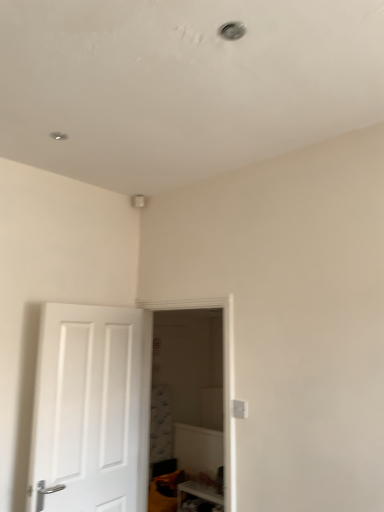
Where is `transparent glass door at center`? The width and height of the screenshot is (384, 512). transparent glass door at center is located at coordinates (223, 378).

Where is `white matte door at left`? The height and width of the screenshot is (512, 384). white matte door at left is located at coordinates (91, 410).

Which is more to the left, transparent glass door at center or white matte door at left?

white matte door at left is more to the left.

In terms of width, does transparent glass door at center look wider or thinner when compared to white matte door at left?

In the image, transparent glass door at center appears to be wider than white matte door at left.

Considering the sizes of objects white glossy shelf at lower right and white matte door at left in the image provided, who is shorter, white glossy shelf at lower right or white matte door at left?

white glossy shelf at lower right.

Which object is closer to the camera taking this photo, white glossy shelf at lower right or white matte door at left?

white matte door at left is more forward.

Are white glossy shelf at lower right and white matte door at left far apart?

white glossy shelf at lower right is far away from white matte door at left.

Is white matte door at left situated inside white glossy shelf at lower right or outside?

The correct answer is: outside.

Is white matte door at left bigger or smaller than white glossy shelf at lower right?

white matte door at left is bigger than white glossy shelf at lower right.

Consider the image. From the image's perspective, is white matte door at left below white glossy shelf at lower right?

Incorrect, from the image's perspective, white matte door at left is higher than white glossy shelf at lower right.

This screenshot has height=512, width=384. Find the location of `glass door on the left side of white glossy shelf at lower right`. glass door on the left side of white glossy shelf at lower right is located at coordinates 223,378.

Considering the positions of objects transparent glass door at center and white glossy shelf at lower right in the image provided, who is behind, transparent glass door at center or white glossy shelf at lower right?

white glossy shelf at lower right is behind.

Is transparent glass door at center oriented away from white glossy shelf at lower right?

No, transparent glass door at center is not facing away from white glossy shelf at lower right.

In terms of width, does transparent glass door at center look wider or thinner when compared to white glossy shelf at lower right?

Considering their sizes, transparent glass door at center looks slimmer than white glossy shelf at lower right.

Is white glossy shelf at lower right facing towards transparent glass door at center?

No, white glossy shelf at lower right is not oriented towards transparent glass door at center.

Is white glossy shelf at lower right behind transparent glass door at center?

Yes, white glossy shelf at lower right is further from the viewer.

Does white glossy shelf at lower right appear on the right side of transparent glass door at center?

Yes.

Who is taller, white glossy shelf at lower right or transparent glass door at center?

With more height is transparent glass door at center.

From a real-world perspective, does white matte door at left sit lower than transparent glass door at center?

Correct, in the physical world, white matte door at left is lower than transparent glass door at center.

Is point (69, 465) farther from camera compared to point (227, 389)?

That is True.

At what (x,y) coordinates should I click in order to perform the action: click on door on the left of the transparent glass door at center. Please return your answer as a coordinate pair (x, y). Looking at the image, I should click on (91, 410).

Where is `furniture on the right of white matte door at left`? furniture on the right of white matte door at left is located at coordinates (198, 493).

From the image, which object appears to be farther from white glossy shelf at lower right, transparent glass door at center or white matte door at left?

The object further to white glossy shelf at lower right is transparent glass door at center.

From the image, which object appears to be nearer to white matte door at left, white glossy shelf at lower right or transparent glass door at center?

Based on the image, transparent glass door at center appears to be nearer to white matte door at left.

Looking at this image, from the image, which object appears to be farther from transparent glass door at center, white matte door at left or white glossy shelf at lower right?

The object further to transparent glass door at center is white glossy shelf at lower right.

Which object lies further to the anchor point white matte door at left, transparent glass door at center or white glossy shelf at lower right?

white glossy shelf at lower right is further to white matte door at left.

Based on their spatial positions, is white matte door at left or transparent glass door at center closer to white glossy shelf at lower right?

white matte door at left is positioned closer to the anchor white glossy shelf at lower right.

Looking at the image, which one is located closer to transparent glass door at center, white glossy shelf at lower right or white matte door at left?

white matte door at left lies closer to transparent glass door at center than the other object.

Where is `glass door located between white matte door at left and white glossy shelf at lower right in the depth direction`? glass door located between white matte door at left and white glossy shelf at lower right in the depth direction is located at coordinates (223, 378).